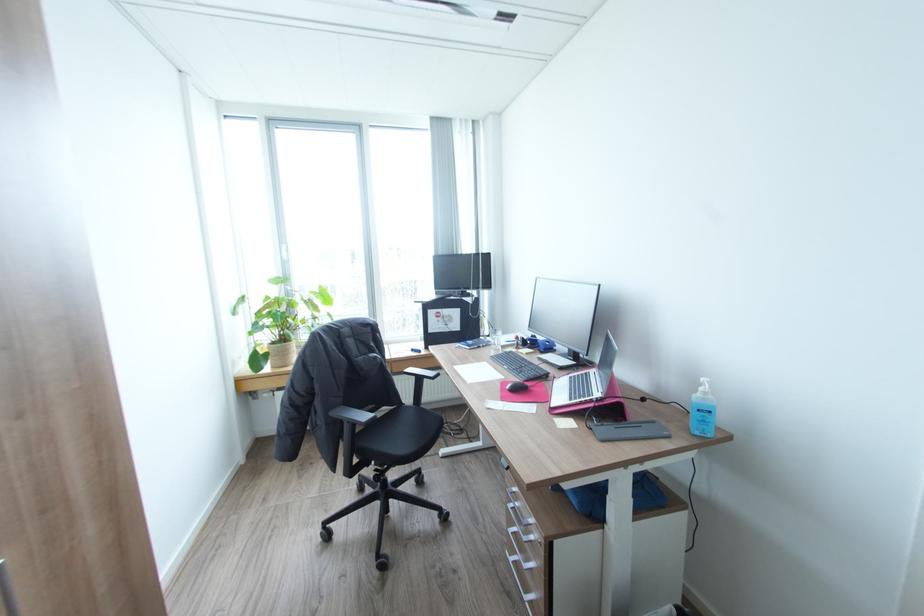
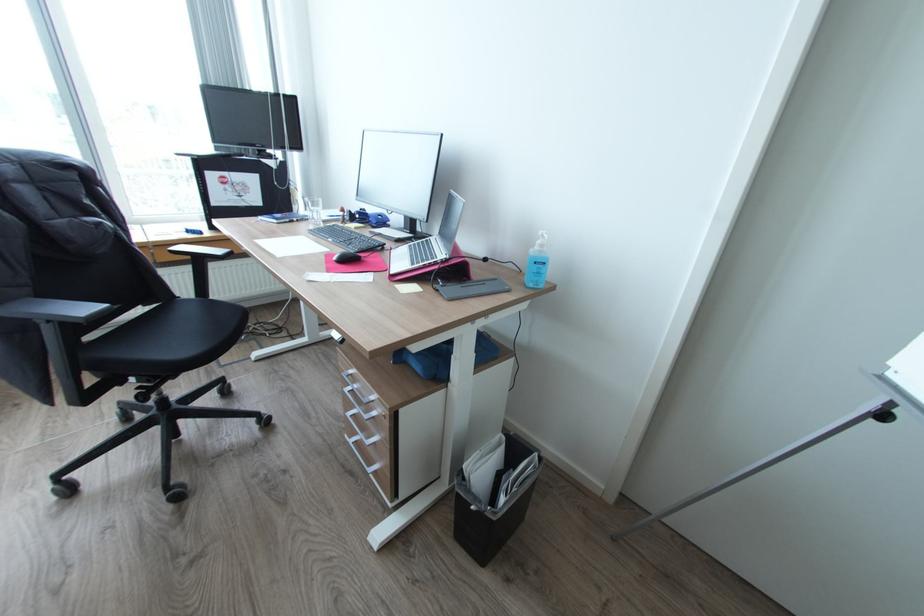
Locate, in the second image, the point that corresponds to (513,387) in the first image.

(339, 257)